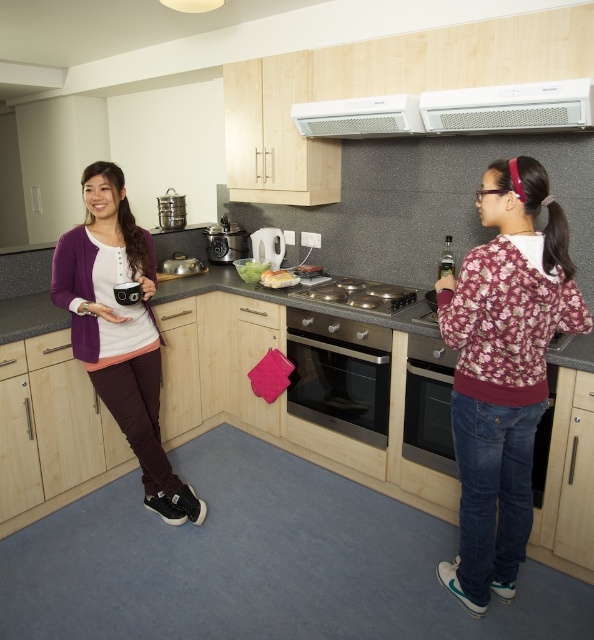
Who is shorter, granite gray countertop at center or white glossy toaster at center?

With less height is white glossy toaster at center.

Can you confirm if granite gray countertop at center is smaller than white glossy toaster at center?

Incorrect, granite gray countertop at center is not smaller in size than white glossy toaster at center.

Is point (425, 332) behind point (257, 234)?

No, (425, 332) is closer to viewer.

You are a GUI agent. You are given a task and a screenshot of the screen. Output one action in this format:
    pyautogui.click(x=<x>, y=<y>)
    Task: Click on the granite gray countertop at center
    This screenshot has width=594, height=640.
    Given the screenshot: What is the action you would take?
    pyautogui.click(x=295, y=300)

Does matte purple cardigan at left lie in front of white plastic exhaust hood at upper center?

Yes, it is.

Can you confirm if matte purple cardigan at left is shorter than white plastic exhaust hood at upper center?

No.

In the scene shown: Measure the distance between point (102, 275) and camera.

Point (102, 275) is 7.12 feet away from camera.

Image resolution: width=594 pixels, height=640 pixels. Find the location of `matte purple cardigan at left`. matte purple cardigan at left is located at coordinates (119, 330).

Does white plastic exhaust hood at upper center appear on the right side of white creamy cheese at center?

Yes, white plastic exhaust hood at upper center is to the right of white creamy cheese at center.

Is point (327, 115) farther from camera compared to point (268, 280)?

That is False.

Image resolution: width=594 pixels, height=640 pixels. I want to click on white plastic exhaust hood at upper center, so (359, 116).